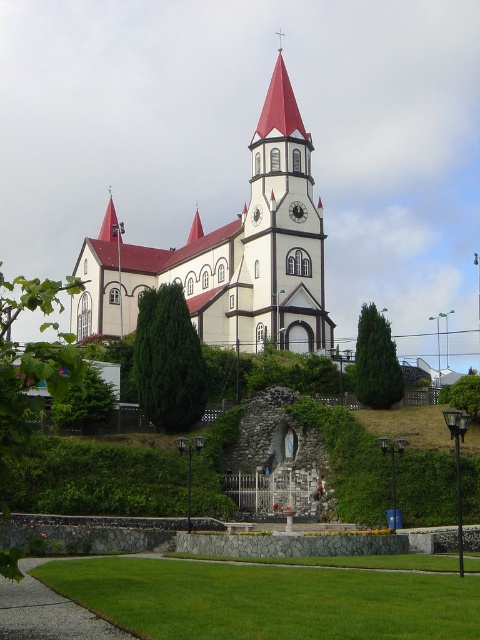
Question: Which point is farther from the camera taking this photo?

Choices:
 (A) (292, 100)
 (B) (112, 232)
 (C) (257, 204)

Answer: (B)

Question: Is smooth red spire at center in front of metallic clock face at center?

Choices:
 (A) yes
 (B) no

Answer: (B)

Question: Does white stucco church at center appear under metallic clock face at center?

Choices:
 (A) no
 (B) yes

Answer: (B)

Question: From the image, what is the correct spatial relationship of white stucco church at center in relation to metallic clock face at center?

Choices:
 (A) below
 (B) above

Answer: (A)

Question: Which object is farther from the camera taking this photo?

Choices:
 (A) smooth red spire at center
 (B) white stucco church at center
 (C) smooth red spire at upper center

Answer: (C)

Question: Estimate the real-world distances between objects in this image. Which object is closer to the metallic clock face at center?

Choices:
 (A) white stucco church at center
 (B) white stone clock tower at center

Answer: (B)